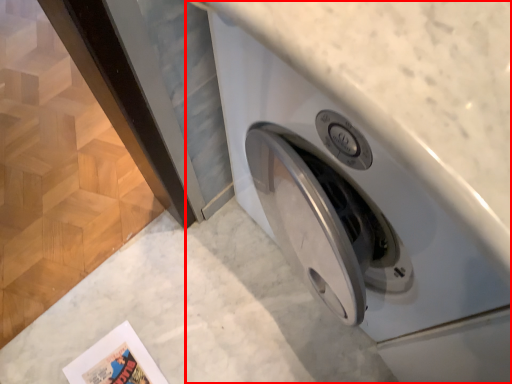
Question: Where is washing machine (annotated by the red box) located in relation to comic book in the image?

Choices:
 (A) right
 (B) left

Answer: (A)